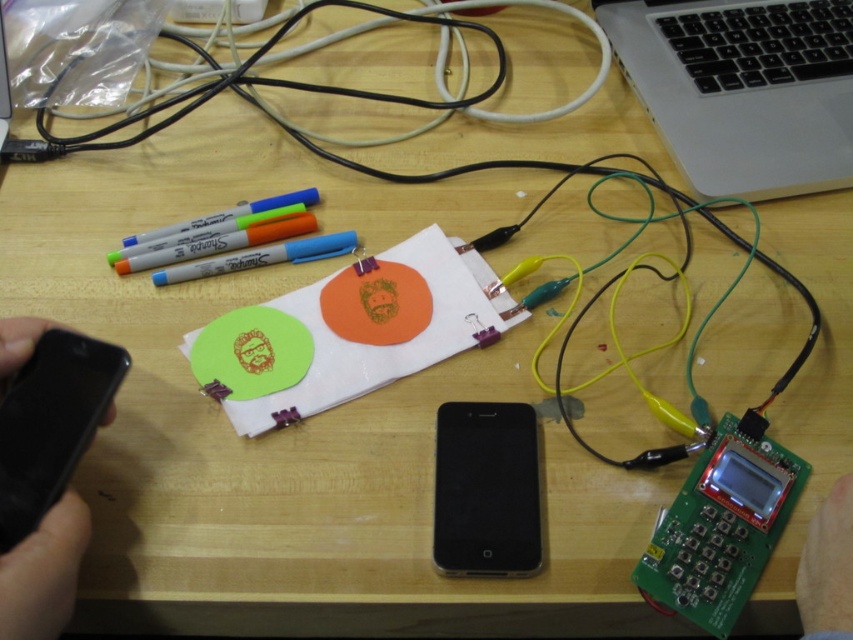
Is black matte smartphone at center positioned at the back of skinny white hand at lower right?

That is True.

Is black matte smartphone at center to the right of skinny white hand at lower right from the viewer's perspective?

Incorrect, black matte smartphone at center is not on the right side of skinny white hand at lower right.

Which is in front, point (538, 474) or point (828, 632)?

Positioned in front is point (828, 632).

Identify the location of black matte smartphone at center. (486, 490).

Is point (845, 48) more distant than point (45, 515)?

Yes, it is.

Based on the photo, how much distance is there between silver metallic laptop at upper right and black matte phone at left?

silver metallic laptop at upper right and black matte phone at left are 60.60 centimeters apart.

Where is `silver metallic laptop at upper right`? This screenshot has height=640, width=853. silver metallic laptop at upper right is located at coordinates (741, 88).

Can you confirm if silver metallic laptop at upper right is wider than skinny white hand at lower right?

Correct, the width of silver metallic laptop at upper right exceeds that of skinny white hand at lower right.

Which is behind, point (757, 102) or point (799, 592)?

Positioned behind is point (757, 102).

Does point (602, 19) come behind point (828, 509)?

That is True.

The image size is (853, 640). What are the coordinates of `silver metallic laptop at upper right` in the screenshot? It's located at (x=741, y=88).